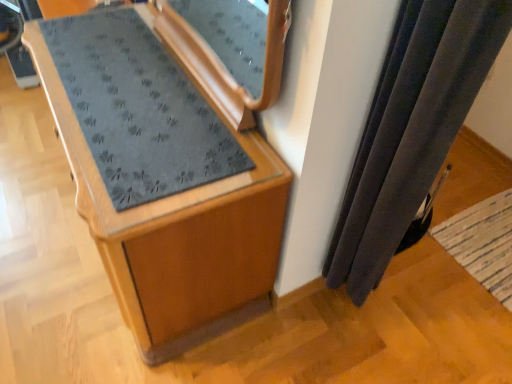
Find the location of `vacant region above wooden cabinet at center (from a real-world perspective)`. vacant region above wooden cabinet at center (from a real-world perspective) is located at coordinates (116, 95).